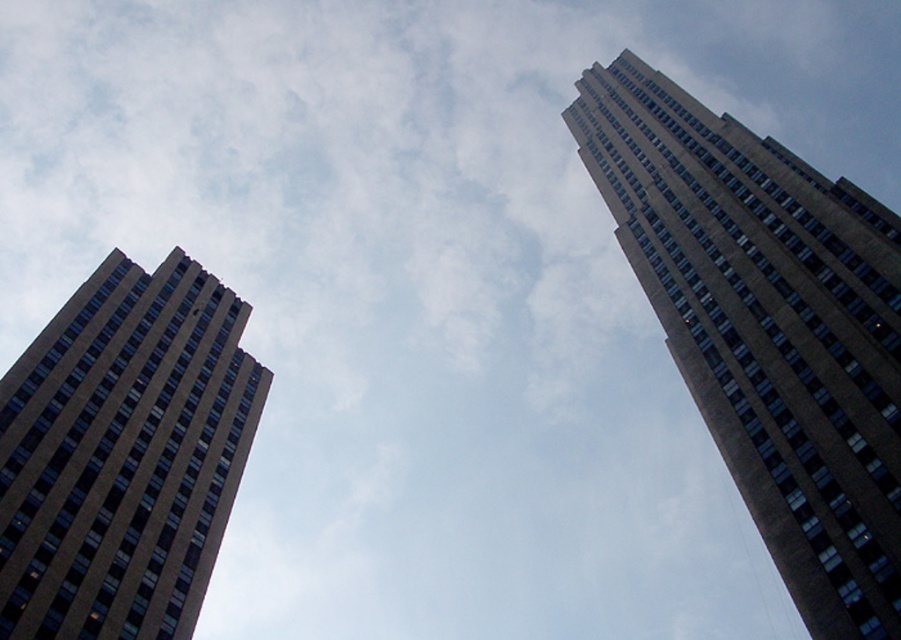
Question: Is brown concrete building at right smaller than brown concrete building at left?

Choices:
 (A) yes
 (B) no

Answer: (B)

Question: Among these objects, which one is nearest to the camera?

Choices:
 (A) brown concrete building at right
 (B) brown concrete building at left

Answer: (A)

Question: Is brown concrete building at right closer to camera compared to brown concrete building at left?

Choices:
 (A) no
 (B) yes

Answer: (B)

Question: Does brown concrete building at right lie behind brown concrete building at left?

Choices:
 (A) no
 (B) yes

Answer: (A)